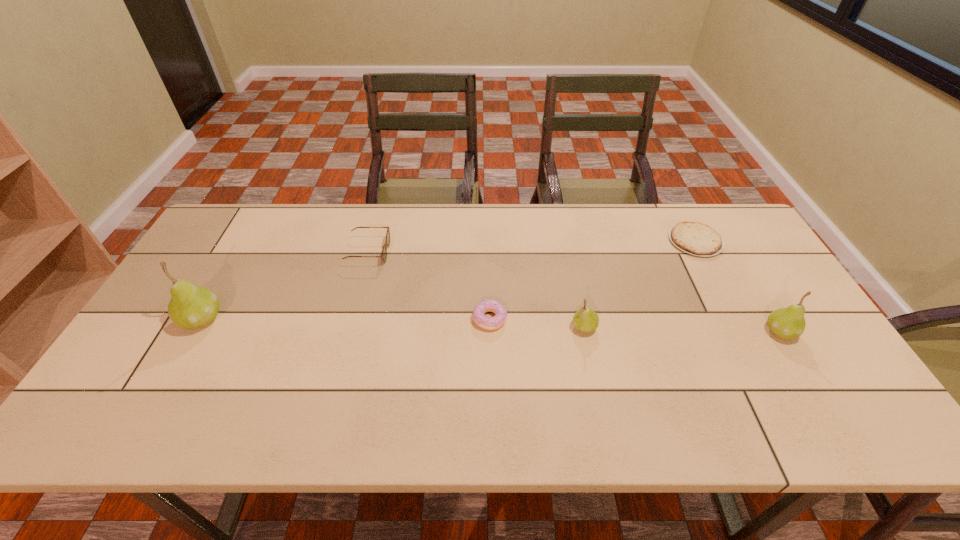
I want to click on the fifth tallest object, so click(x=489, y=323).

Identify the location of vacant space located on the back of the leftmost pear. Image resolution: width=960 pixels, height=540 pixels. coord(256,225).

You are a GUI agent. You are given a task and a screenshot of the screen. Output one action in this format:
    pyautogui.click(x=<x>, y=<y>)
    Task: Click on the free space located 0.250m on the right of the third object from right to left
    The height and width of the screenshot is (540, 960).
    Given the screenshot: What is the action you would take?
    pyautogui.click(x=691, y=327)

At what (x,y) coordinates should I click in order to perform the action: click on free location located 0.180m on the left of the second shortest pear. Please return your answer as a coordinate pair (x, y). Image resolution: width=960 pixels, height=540 pixels. Looking at the image, I should click on (696, 332).

I want to click on vacant space positioned 0.050m at the front view of the spectacles, so click(x=404, y=252).

The width and height of the screenshot is (960, 540). I want to click on vacant space situated on the back of the tortilla, so click(x=675, y=204).

Where is `blank area located 0.400m on the back of the third object from left to right`? This screenshot has width=960, height=540. blank area located 0.400m on the back of the third object from left to right is located at coordinates (488, 217).

The height and width of the screenshot is (540, 960). In order to click on spectacles at the far edge in this screenshot , I will do `click(384, 251)`.

You are a GUI agent. You are given a task and a screenshot of the screen. Output one action in this format:
    pyautogui.click(x=<x>, y=<y>)
    Task: Click on the tortilla that is at the far edge
    
    Given the screenshot: What is the action you would take?
    pyautogui.click(x=695, y=238)

Locate an element on the screen. This screenshot has width=960, height=540. object that is at the left edge is located at coordinates (191, 306).